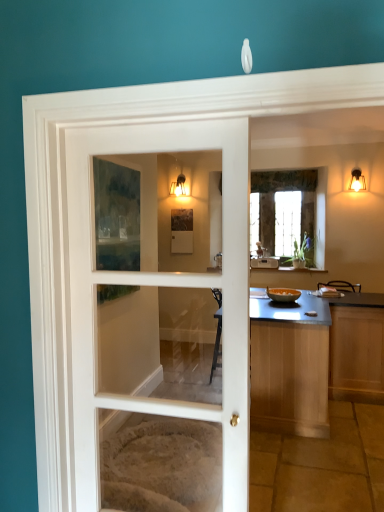
Question: Is white glass door at center a part of matte glass sconce at upper center, the 1th light fixture in the left-to-right sequence?

Choices:
 (A) yes
 (B) no

Answer: (B)

Question: From the image's perspective, is matte glass sconce at upper center, arranged as the 1th light fixture when viewed from the back, under white glass door at center?

Choices:
 (A) yes
 (B) no

Answer: (B)

Question: Can you confirm if matte glass sconce at upper center, acting as the 2th light fixture starting from the front, is bigger than white glass door at center?

Choices:
 (A) yes
 (B) no

Answer: (B)

Question: From a real-world perspective, does matte glass sconce at upper center, arranged as the 1th light fixture when viewed from the back, stand above white glass door at center?

Choices:
 (A) yes
 (B) no

Answer: (A)

Question: Considering the relative sizes of matte glass sconce at upper center, arranged as the 1th light fixture when viewed from the back, and white glass door at center in the image provided, is matte glass sconce at upper center, arranged as the 1th light fixture when viewed from the back, wider than white glass door at center?

Choices:
 (A) no
 (B) yes

Answer: (B)

Question: Is point (301, 314) closer or farther from the camera than point (354, 183)?

Choices:
 (A) farther
 (B) closer

Answer: (B)

Question: From a real-world perspective, is smooth wooden countertop at center positioned above or below matte gold light fixture at upper right, the 1th light fixture viewed from the right?

Choices:
 (A) below
 (B) above

Answer: (A)

Question: In the image, is smooth wooden countertop at center positioned in front of or behind matte gold light fixture at upper right, the 1th light fixture positioned from the front?

Choices:
 (A) front
 (B) behind

Answer: (A)

Question: Based on their positions, is smooth wooden countertop at center located to the left or right of matte gold light fixture at upper right, the 1th light fixture positioned from the front?

Choices:
 (A) left
 (B) right

Answer: (A)

Question: From a real-world perspective, relative to smooth wooden countertop at center, is white glass door at center vertically above or below?

Choices:
 (A) above
 (B) below

Answer: (A)

Question: Is white glass door at center taller or shorter than smooth wooden countertop at center?

Choices:
 (A) short
 (B) tall

Answer: (B)

Question: Based on their positions, is white glass door at center located to the left or right of smooth wooden countertop at center?

Choices:
 (A) left
 (B) right

Answer: (A)

Question: From the image's perspective, relative to smooth wooden countertop at center, is white glass door at center above or below?

Choices:
 (A) above
 (B) below

Answer: (A)

Question: Would you say matte glass sconce at upper center, the 1th light fixture in the left-to-right sequence, is to the left or to the right of smooth wooden countertop at center in the picture?

Choices:
 (A) right
 (B) left

Answer: (B)

Question: Looking at their shapes, would you say matte glass sconce at upper center, the 1th light fixture in the left-to-right sequence, is wider or thinner than smooth wooden countertop at center?

Choices:
 (A) wide
 (B) thin

Answer: (B)